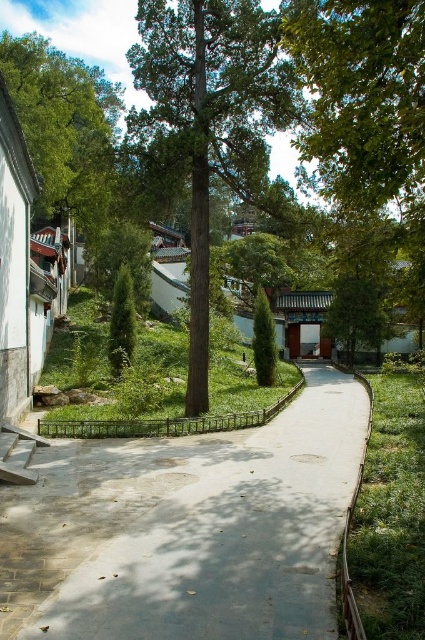
Is gray concrete pavement at center taller than green textured tree at center?

Incorrect, gray concrete pavement at center's height is not larger of green textured tree at center's.

Can you confirm if gray concrete pavement at center is positioned below green textured tree at center?

Yes, gray concrete pavement at center is below green textured tree at center.

Between point (223, 531) and point (255, 196), which one is positioned behind?

Point (255, 196)

The width and height of the screenshot is (425, 640). Identify the location of gray concrete pavement at center. (223, 531).